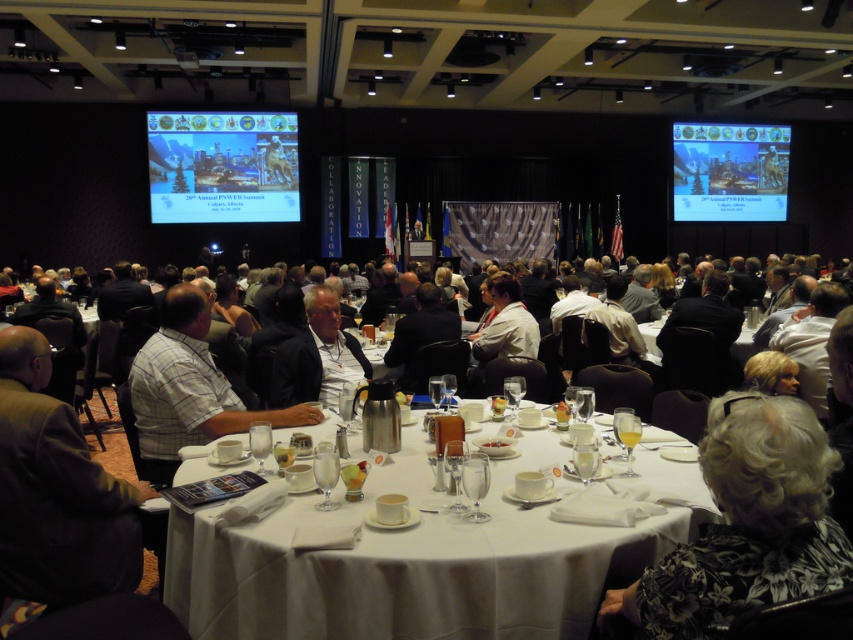
Which is behind, point (18, 417) or point (653, 328)?

Positioned behind is point (653, 328).

Is point (44, 410) behind point (743, 358)?

That is False.

Locate an element on the screen. Image resolution: width=853 pixels, height=640 pixels. gray plaid shirt at center is located at coordinates (57, 492).

Is white cloth-covered table at center taller than matte plastic projector screen at upper left?

No, white cloth-covered table at center is not taller than matte plastic projector screen at upper left.

Can you confirm if white cloth-covered table at center is positioned to the left of matte plastic projector screen at upper left?

Incorrect, white cloth-covered table at center is not on the left side of matte plastic projector screen at upper left.

Is point (392, 472) positioned before point (296, 170)?

Yes, it is.

Where is `white cloth-covered table at center`? The image size is (853, 640). white cloth-covered table at center is located at coordinates (422, 560).

Is point (171, 304) farther from viewer compared to point (689, 144)?

That is False.

Which is above, plaid shirt at center or matte plastic projector screen at upper right?

matte plastic projector screen at upper right is higher up.

Identify the location of plaid shirt at center. The height and width of the screenshot is (640, 853). (189, 388).